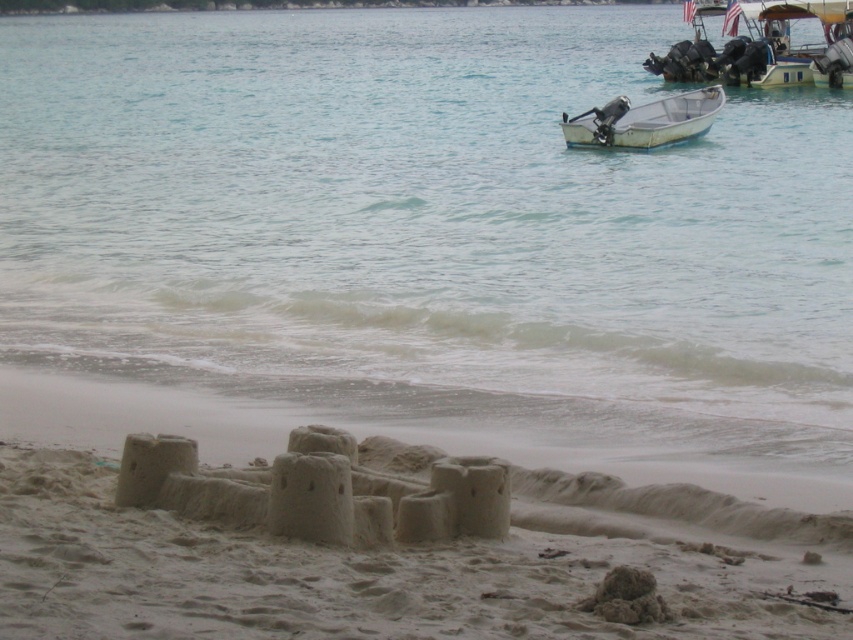
Does clear water at sand lower have a lesser height compared to metallic silver boat at upper right?

Incorrect, clear water at sand lower's height does not fall short of metallic silver boat at upper right's.

This screenshot has width=853, height=640. What do you see at coordinates (427, 227) in the screenshot?
I see `clear water at sand lower` at bounding box center [427, 227].

Does point (575, 320) come in front of point (703, 131)?

Yes, it is.

Where is `clear water at sand lower`? This screenshot has width=853, height=640. clear water at sand lower is located at coordinates (427, 227).

The height and width of the screenshot is (640, 853). What do you see at coordinates (427, 227) in the screenshot?
I see `clear water at sand lower` at bounding box center [427, 227].

Can you confirm if clear water at sand lower is smaller than yellow plastic boat at upper right?

Actually, clear water at sand lower might be larger than yellow plastic boat at upper right.

Who is more distant from viewer, (194, 54) or (773, 36)?

The point (194, 54) is behind.

In order to click on clear water at sand lower in this screenshot , I will do `click(427, 227)`.

Is point (668, 560) behind point (821, 4)?

No, it is in front of (821, 4).

Can you confirm if beige sandy castle at lower center is wider than yellow plastic boat at upper right?

Yes.

Which is in front, point (80, 557) or point (772, 84)?

Point (80, 557)

This screenshot has width=853, height=640. I want to click on beige sandy castle at lower center, so click(396, 566).